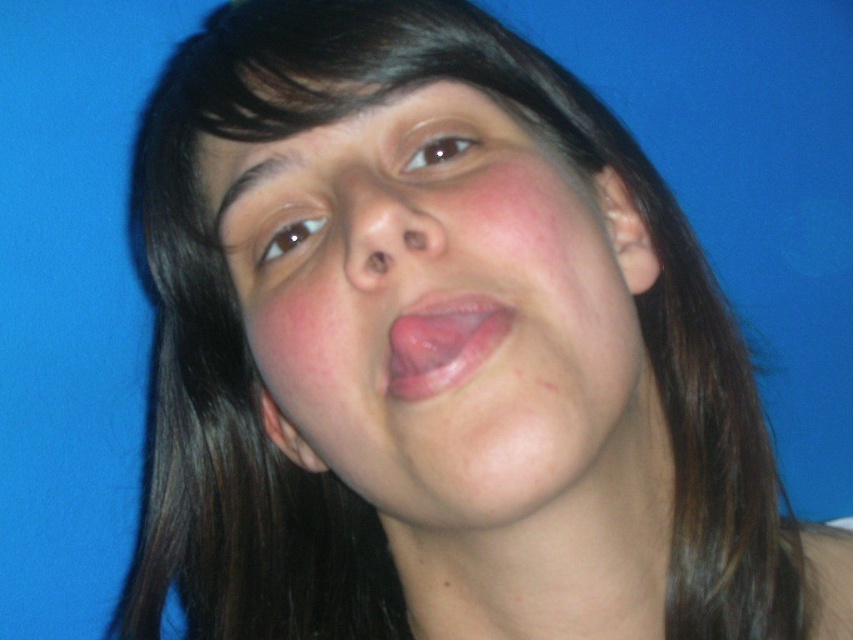
Question: Which object is farther from the camera taking this photo?

Choices:
 (A) pink flesh at center
 (B) smooth skin nose at center
 (C) smooth skin face at center

Answer: (B)

Question: Which point is closer to the camera?

Choices:
 (A) (351, 176)
 (B) (447, 298)
 (C) (416, 330)

Answer: (B)

Question: Which of the following is the farthest from the observer?

Choices:
 (A) pink flesh at center
 (B) smooth skin nose at center
 (C) smooth skin face at center

Answer: (B)

Question: Can you confirm if smooth skin face at center is bigger than smooth skin nose at center?

Choices:
 (A) no
 (B) yes

Answer: (B)

Question: Is smooth skin face at center to the right of pink flesh at center from the viewer's perspective?

Choices:
 (A) yes
 (B) no

Answer: (B)

Question: Does smooth skin nose at center have a larger size compared to pink flesh at center?

Choices:
 (A) yes
 (B) no

Answer: (A)